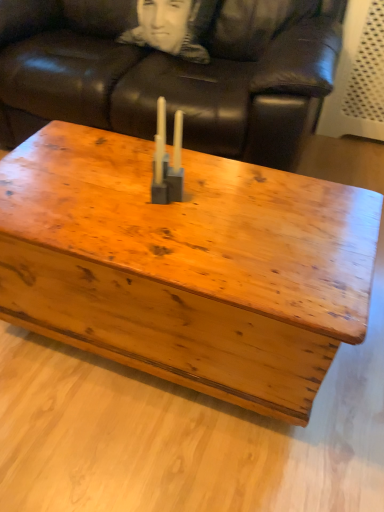
The image size is (384, 512). I want to click on empty space that is ontop of wooden coffee table at center, so click(180, 205).